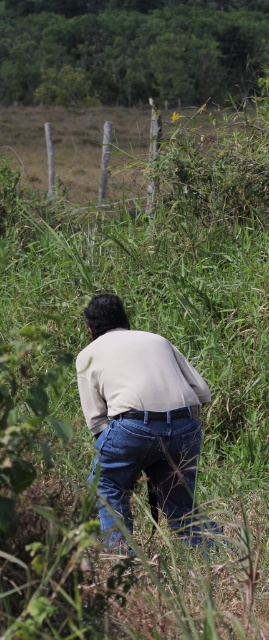
Based on the photo, between green grass at upper center and blue denim jeans at center, which one appears on the left side from the viewer's perspective?

green grass at upper center

Who is more distant from viewer, (61, 67) or (103, 477)?

Positioned behind is point (61, 67).

Identify the location of green grass at upper center. This screenshot has height=640, width=269. (131, 51).

Is point (172, 376) closer to camera compared to point (185, 490)?

Yes, it is.

Can you confirm if light beige shirt at center is positioned to the right of blue denim jeans at center?

In fact, light beige shirt at center is to the left of blue denim jeans at center.

Measure the distance between point (179,400) and camera.

They are 3.79 meters apart.

I want to click on light beige shirt at center, so (140, 412).

Who is more distant from viewer, [58,10] or [188,538]?

The point [58,10] is more distant.

Where is `green grass at upper center`? green grass at upper center is located at coordinates (131, 51).